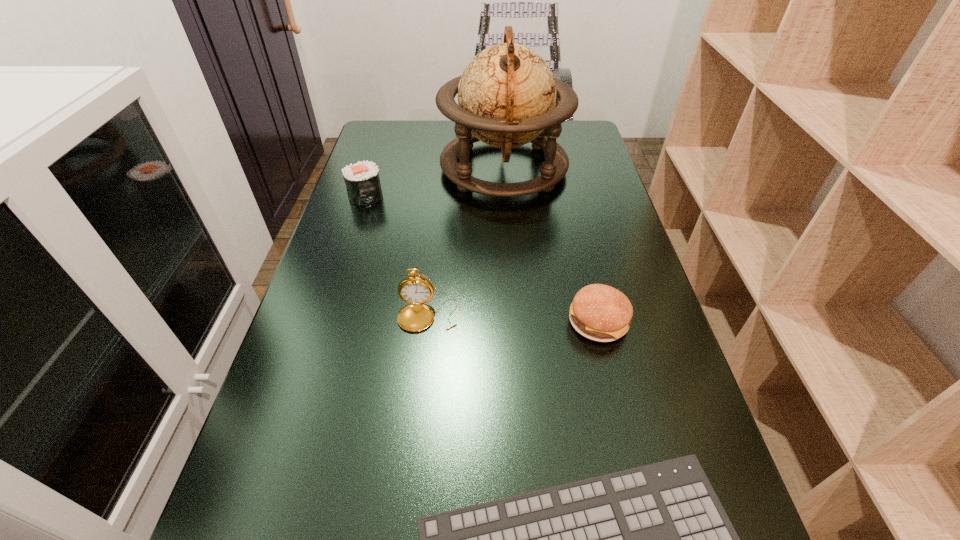
At what (x,y) coordinates should I click in order to perform the action: click on object present at the left edge. Please return your answer as a coordinate pair (x, y). The height and width of the screenshot is (540, 960). Looking at the image, I should click on (362, 180).

Where is `globe situated at the right edge`? globe situated at the right edge is located at coordinates pyautogui.click(x=507, y=93).

Find the location of a particular element. hamburger at the right edge is located at coordinates (599, 312).

You are a GUI agent. You are given a task and a screenshot of the screen. Output one action in this format:
    pyautogui.click(x=<x>, y=<y>)
    Task: Click on the object at the far right corner
    
    Given the screenshot: What is the action you would take?
    pyautogui.click(x=507, y=93)

The width and height of the screenshot is (960, 540). In the image, there is a desktop. What are the coordinates of `vacant space at the far edge` in the screenshot? It's located at (450, 123).

Where is `free space at the left edge of the desktop`? free space at the left edge of the desktop is located at coordinates (350, 386).

You are a GUI agent. You are given a task and a screenshot of the screen. Output one action in this format:
    pyautogui.click(x=<x>, y=<y>)
    Task: Click on the free region at the right edge
    This screenshot has height=540, width=960.
    Given the screenshot: What is the action you would take?
    pyautogui.click(x=682, y=399)

Where is `vacant area at the far left corner of the desktop`? This screenshot has height=540, width=960. vacant area at the far left corner of the desktop is located at coordinates (409, 122).

Locate an element on the screen. The image size is (960, 540). vacant region between the pocket watch and the tallest object is located at coordinates (466, 241).

Where is `vacant area between the pocket watch and the tallest object`? The image size is (960, 540). vacant area between the pocket watch and the tallest object is located at coordinates (466, 241).